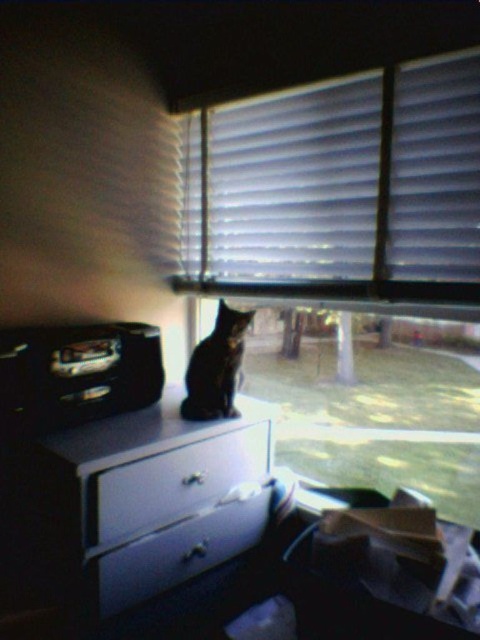
You are a delivery robot that is 1 meter tall. You need to deliver a package to the white textured blinds at upper center. Can you reach it?

The white textured blinds at upper center and viewer are 1.21 meters apart. Since the robot is 1 meter tall, it cannot reach the blinds as the distance is greater than its height.

You are trying to decide whether to place a small decorative item on either the white textured blinds at upper center or the white glossy drawer at lower center. Based on their sizes, which surface can accommodate a larger item?

The white textured blinds at upper center is larger in size than the white glossy drawer at lower center, so the white textured blinds at upper center can accommodate a larger item.

You are a photographer standing in the room and want to take a closeup shot of the white textured blinds at upper center. Your camera has a minimum focusing distance of 1 meter. Can you take the photo without moving closer than 1 meter?

The distance of white textured blinds at upper center from the camera is 1.21 meters, which is beyond the camera minimum focusing distance of 1 meter. Therefore, you can take the closeup shot without moving closer than 1 meter.